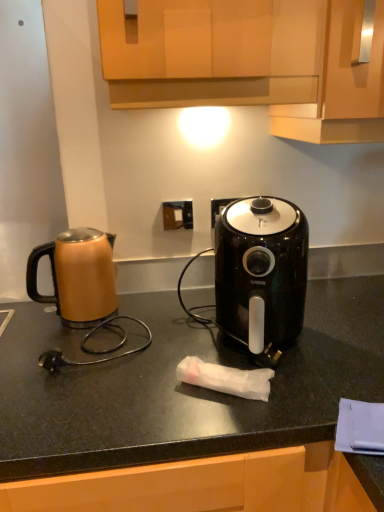
Identify the location of vacant area situated to the left side of matte brown kettle at left. (20, 317).